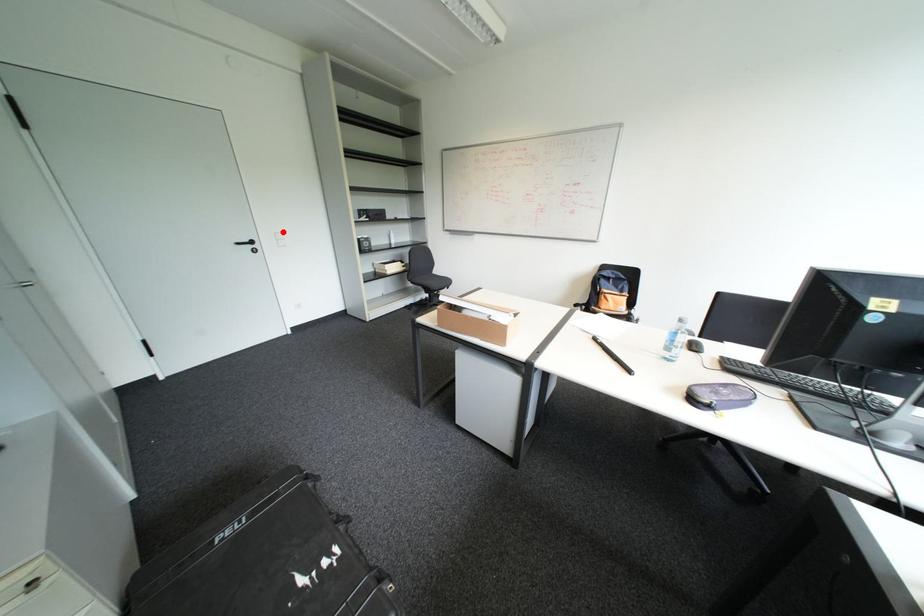
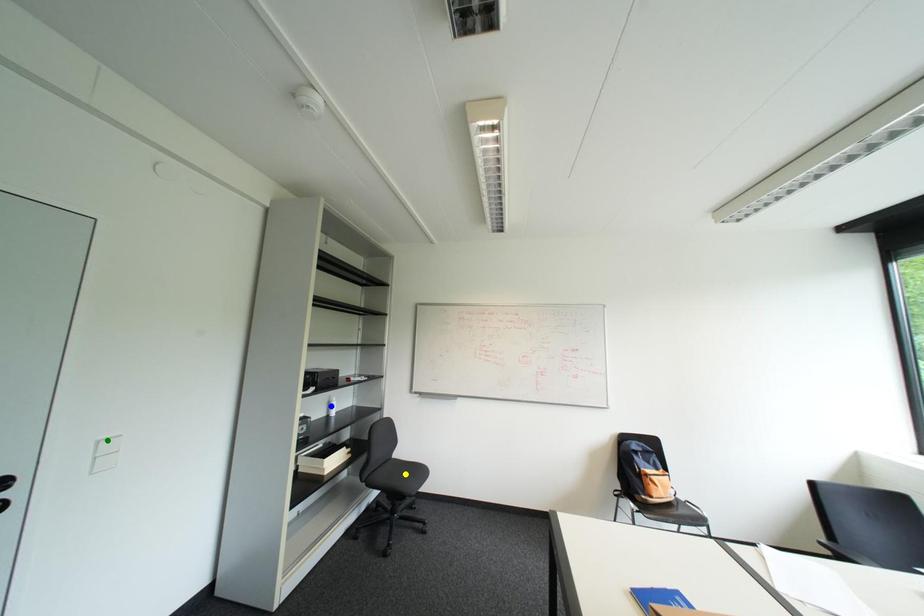
Question: I am providing you with two images of the same scene from different viewpoints. A red point is marked on the first image. You are given multiple points on the second image. Can you choose the point in image 2 that corresponds to the point in image 1?

Choices:
 (A) yellow point
 (B) blue point
 (C) green point

Answer: (C)